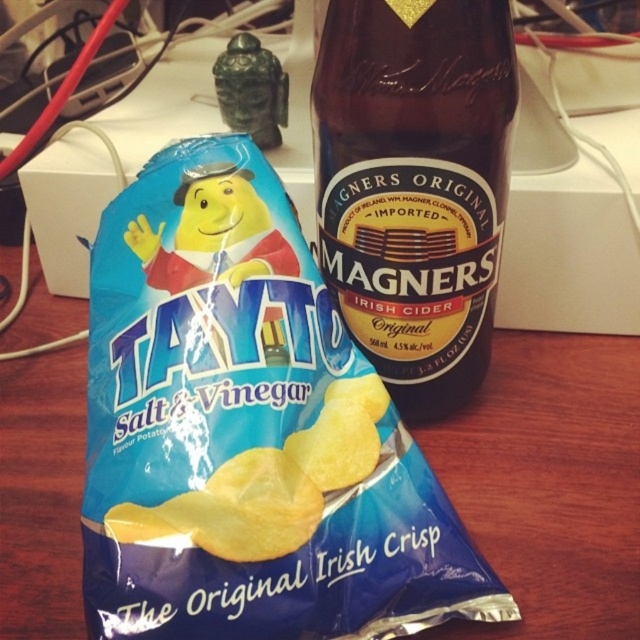
Question: From the image, what is the correct spatial relationship of brown glass bottle at center in relation to blue matte chips at center?

Choices:
 (A) below
 (B) above

Answer: (B)

Question: Which object is closer to the camera taking this photo?

Choices:
 (A) blue matte chips at center
 (B) brown glass bottle at center

Answer: (A)

Question: Estimate the real-world distances between objects in this image. Which object is farther from the brown glass bottle at center?

Choices:
 (A) blue matte chips at center
 (B) blue matte plastic bag of chips at center

Answer: (A)

Question: Is blue matte plastic bag of chips at center smaller than brown glass bottle at center?

Choices:
 (A) no
 (B) yes

Answer: (A)

Question: Which of the following is the farthest from the observer?

Choices:
 (A) (323, 508)
 (B) (445, 100)

Answer: (B)

Question: Can you confirm if blue matte plastic bag of chips at center is positioned to the left of blue matte chips at center?

Choices:
 (A) yes
 (B) no

Answer: (A)